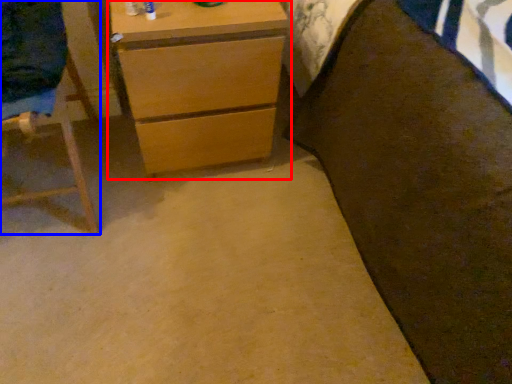
Question: Which object is closer to the camera taking this photo, chest of drawers (highlighted by a red box) or furniture (highlighted by a blue box)?

Choices:
 (A) chest of drawers
 (B) furniture

Answer: (B)